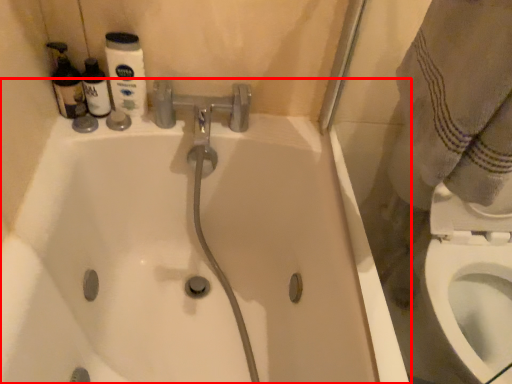
Question: In this image, where is bathtub (annotated by the red box) located relative to bidet?

Choices:
 (A) left
 (B) right

Answer: (A)